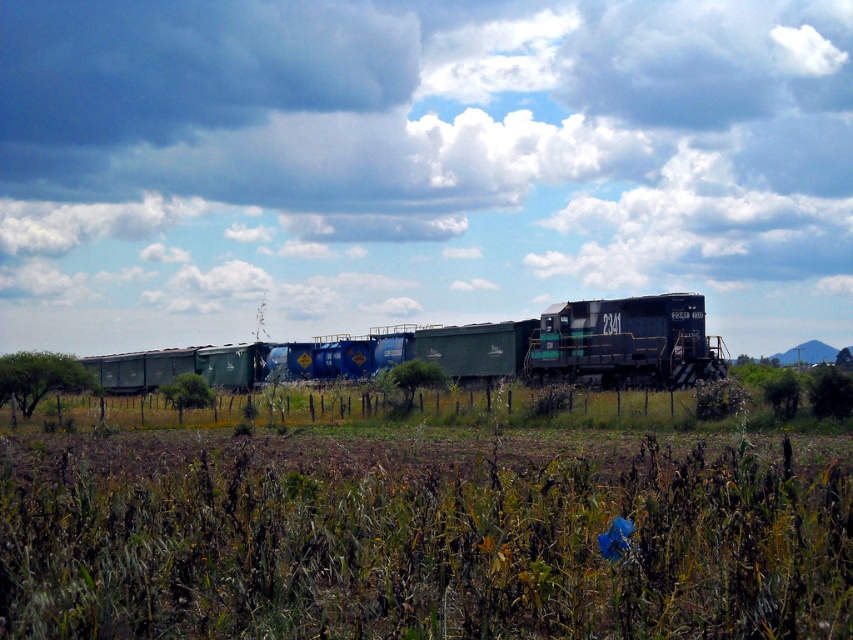
Based on the photo, can you confirm if cloudy sky at upper center is taller than green matte freight car at center?

Correct, cloudy sky at upper center is much taller as green matte freight car at center.

Who is taller, cloudy sky at upper center or green matte freight car at center?

Standing taller between the two is cloudy sky at upper center.

Image resolution: width=853 pixels, height=640 pixels. Find the location of `cloudy sky at upper center`. cloudy sky at upper center is located at coordinates (422, 145).